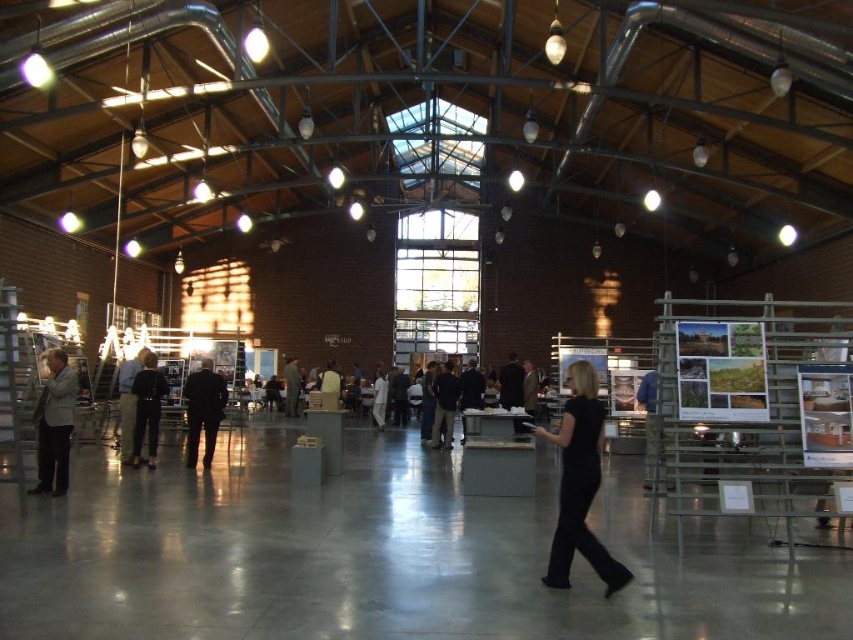
Is black suit at center taller than black fabric jacket at center?

Incorrect, black suit at center's height is not larger of black fabric jacket at center's.

Locate an element on the screen. This screenshot has width=853, height=640. black suit at center is located at coordinates (202, 410).

The height and width of the screenshot is (640, 853). I want to click on black suit at center, so click(x=202, y=410).

Is light beige suit at left bigger than black leather jacket at center?

No.

Who is more distant from viewer, (53,461) or (657,413)?

The point (53,461) is behind.

The width and height of the screenshot is (853, 640). Find the location of `light beige suit at left`. light beige suit at left is located at coordinates (55, 424).

Does black matte dress at center have a greater height compared to dark gray suit at center?

Correct, black matte dress at center is much taller as dark gray suit at center.

Can you confirm if black matte dress at center is positioned to the left of dark gray suit at center?

Incorrect, black matte dress at center is not on the left side of dark gray suit at center.

You are a GUI agent. You are given a task and a screenshot of the screen. Output one action in this format:
    pyautogui.click(x=<x>, y=<y>)
    Task: Click on the black matte dress at center
    Image resolution: width=853 pixels, height=640 pixels.
    Given the screenshot: What is the action you would take?
    pyautogui.click(x=579, y=484)

Locate an element on the screen. Image resolution: width=853 pixels, height=640 pixels. black matte dress at center is located at coordinates (579, 484).